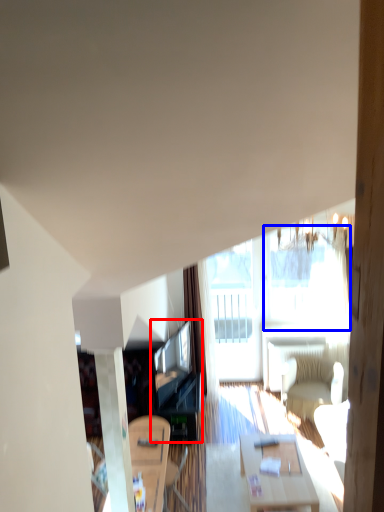
Question: Which of the following is the closest to the observer, entertainment center (highlighted by a red box) or window (highlighted by a blue box)?

Choices:
 (A) entertainment center
 (B) window

Answer: (A)